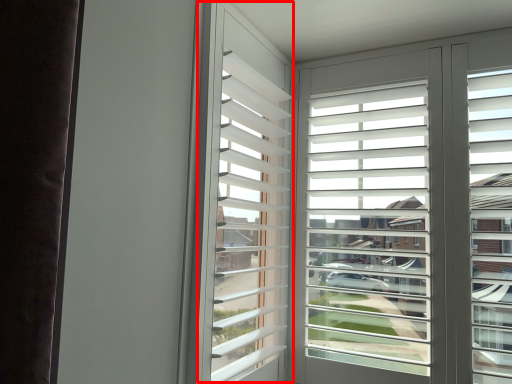
Question: Where is bay window (annotated by the red box) located in relation to window screen in the image?

Choices:
 (A) left
 (B) right

Answer: (A)